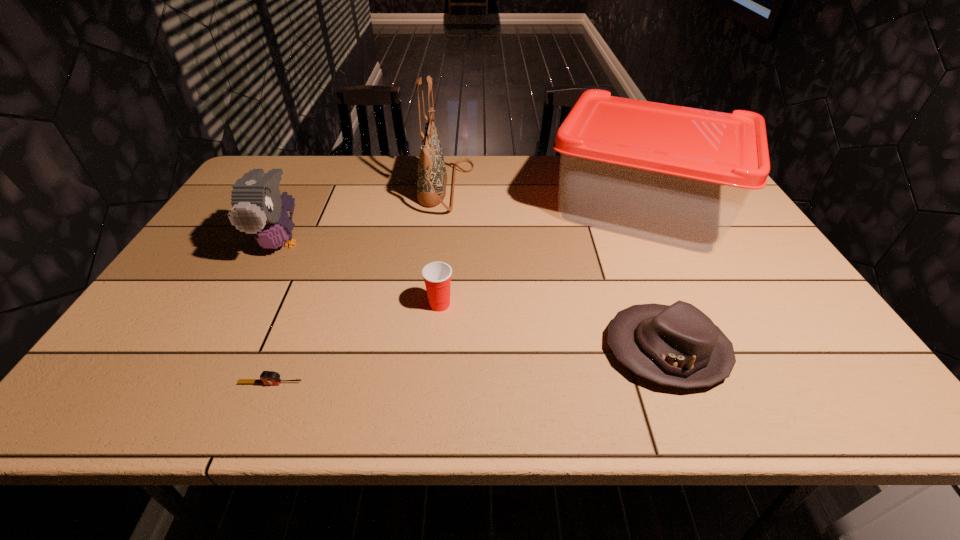
The image size is (960, 540). What are the coordinates of `vacant space situated at the beak of the leftmost object` in the screenshot? It's located at (223, 354).

Find the location of a particular element. Image resolution: width=960 pixels, height=540 pixels. vacant space located on the front of the Dixie cup is located at coordinates (431, 402).

Image resolution: width=960 pixels, height=540 pixels. In order to click on blank area located on the decorative side of the hat in this screenshot , I will do `click(444, 350)`.

Locate an element on the screen. This screenshot has width=960, height=540. free space located on the decorative side of the hat is located at coordinates (505, 350).

You are a GUI agent. You are given a task and a screenshot of the screen. Output one action in this format:
    pyautogui.click(x=<x>, y=<y>)
    Task: Click on the vacant space located 0.250m on the decorative side of the hat
    This screenshot has width=960, height=540.
    Given the screenshot: What is the action you would take?
    pyautogui.click(x=491, y=350)

Image resolution: width=960 pixels, height=540 pixels. Identify the location of vacant area located on the back of the second object from left to right. (287, 341).

This screenshot has width=960, height=540. Identify the location of handbag that is at the far edge. (432, 177).

Locate an element on the screen. This screenshot has height=540, width=960. tray at the far edge is located at coordinates 676,175.

Image resolution: width=960 pixels, height=540 pixels. Identify the location of hat located in the near edge section of the desktop. (677, 345).

The width and height of the screenshot is (960, 540). I want to click on tape measure situated at the near edge, so click(x=267, y=377).